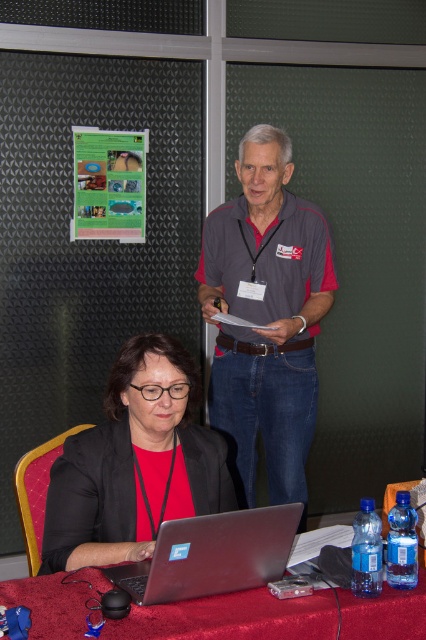
You are a visitor in this room and need to hang a small note on the nearest object. Which object between the matte black jacket at lower left and the matte plastic bulletin board at upper left should you choose?

The matte plastic bulletin board at upper left is the nearest object because it is positioned higher up than the matte black jacket at lower left, which is much taller but located lower down.